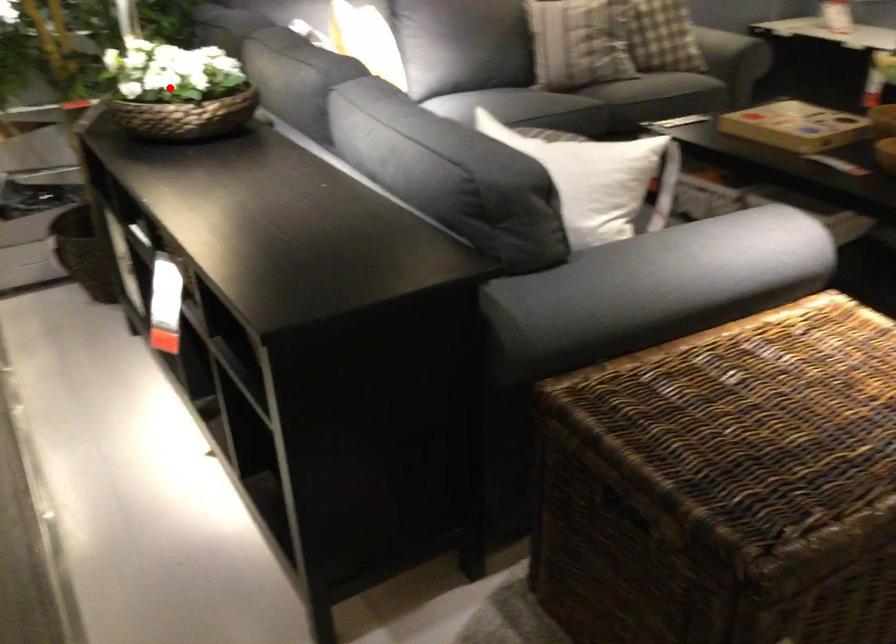
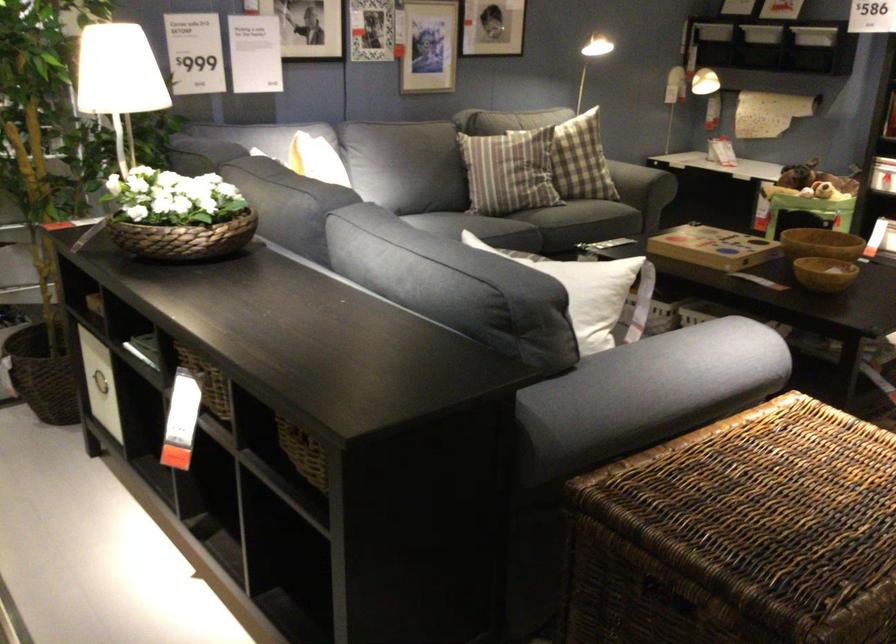
Find the pixel in the second image that matches the highlighted location in the first image.

(177, 216)